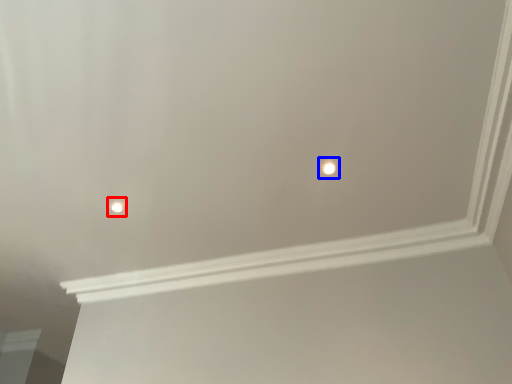
Question: Which object appears closest to the camera in this image, light (highlighted by a red box) or light (highlighted by a blue box)?

Choices:
 (A) light
 (B) light

Answer: (B)